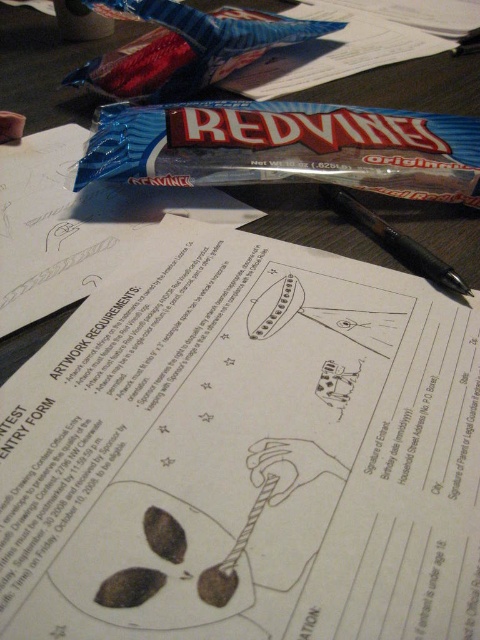
Question: Is blue shiny candy at center thinner than black plastic pen at center?

Choices:
 (A) yes
 (B) no

Answer: (B)

Question: Where is blue shiny candy at center located in relation to black plastic pen at center in the image?

Choices:
 (A) above
 (B) below

Answer: (A)

Question: Can you confirm if blue shiny candy at center is wider than blue foil wrapped candy bar at upper center?

Choices:
 (A) no
 (B) yes

Answer: (A)

Question: Which point appears closest to the camera in this image?

Choices:
 (A) (282, 134)
 (B) (450, 291)
 (C) (324, 589)

Answer: (C)

Question: Which object is farther from the camera taking this photo?

Choices:
 (A) white paper at center
 (B) blue shiny candy at center

Answer: (B)

Question: Which object is closer to the camera taking this photo?

Choices:
 (A) blue shiny candy at center
 (B) white paper at center
 (C) blue foil wrapped candy bar at upper center

Answer: (B)